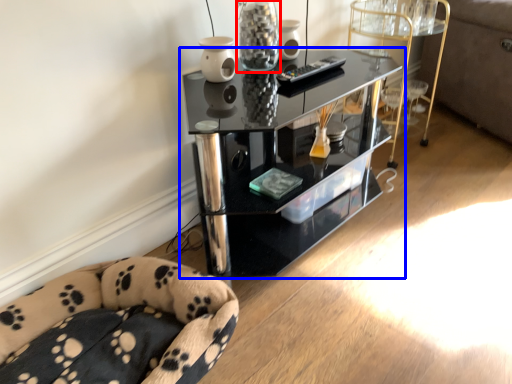
Question: Which point is closer to the camera, glass vase (highlighted by a red box) or shelf (highlighted by a blue box)?

Choices:
 (A) glass vase
 (B) shelf

Answer: (B)